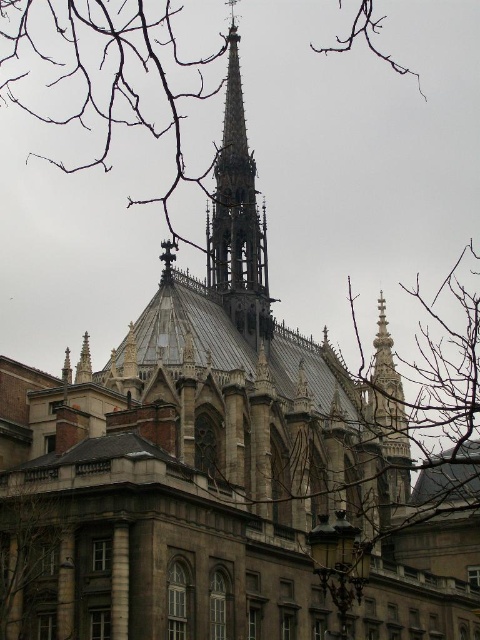
Consider the image. What are the coordinates of the brown wood tree at lower left in the image?

The brown wood tree at lower left is located at coordinates point (35, 566).

You are standing in front of the cathedral and notice two points marked on the structure. The first point is located at coordinates point (420, 424), and the second is at point (48, 618). From your vantage point, which of these points is closer to you?

Point (48, 618) is closer to you because it is in front of point (420, 424).

You are standing at the base of the cathedral and want to take a photo of the point marked at coordinates point [108,145]. Given that the camera you are using has a maximum zoom range of 100 meters, will you be able to capture that point clearly in your photo?

The point [108,145] is 165.07 meters away from the camera, which exceeds the maximum zoom range of 100 meters. Therefore, the camera cannot capture the point clearly at that distance.